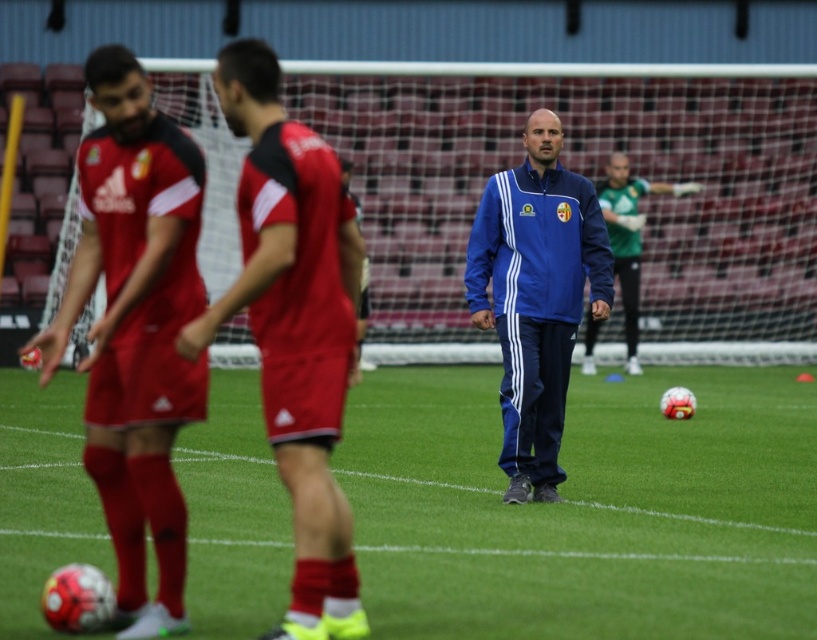
You are a soccer player wearing a red jersey at center and you need to pass the ball to the coach wearing a blue fabric jacket at center. Can you pass the ball directly to him without needing to move closer? Please explain your reasoning based on the distance provided.

The distance between the red jersey at center and the blue fabric jacket at center is 3.92 meters. Since this distance is relatively short, you can pass the ball directly to the coach without needing to move closer, as a typical soccer pass can easily cover that distance.

You are a soccer player standing on the field. You see the green grass at center and the blue fabric jacket at center. Which object is taller?

The blue fabric jacket at center is taller than the green grass at center.

You are a photographer positioned at the origin point of the soccer field. You want to take a photo of the red jersey at center. What are the coordinates where you should aim your camera?

The coordinates to aim the camera are at point (293, 326).